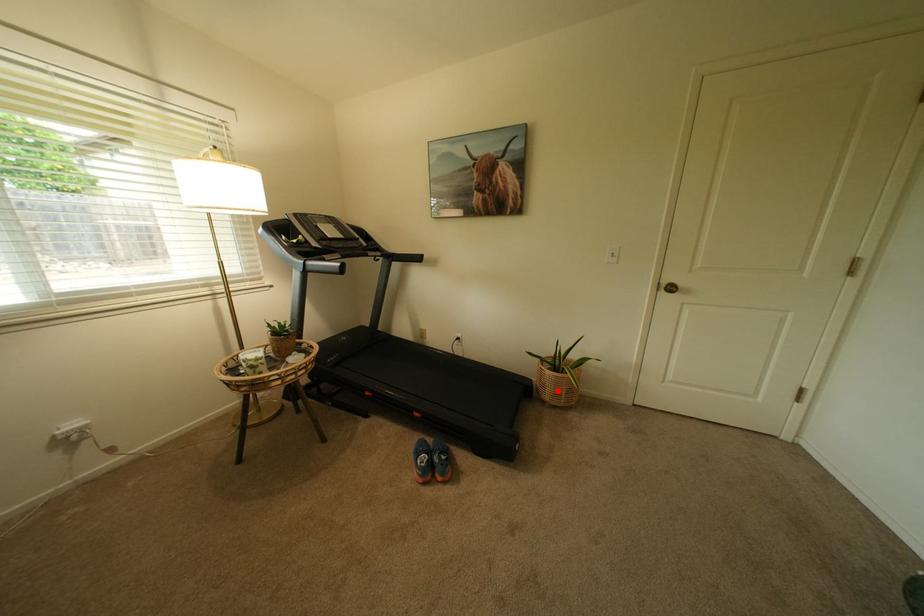
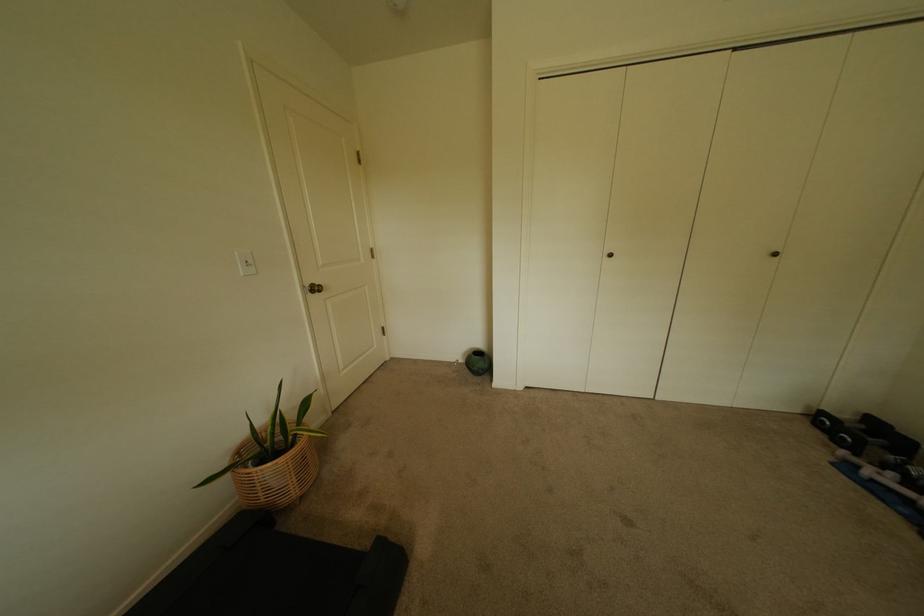
Question: I am providing you with two images of the same scene from different viewpoints. Image1 has a red point marked. In image2, the corresponding 3D location appears at what relative position? Reply with the corresponding letter.

Choices:
 (A) Closer
 (B) Farther

Answer: (A)